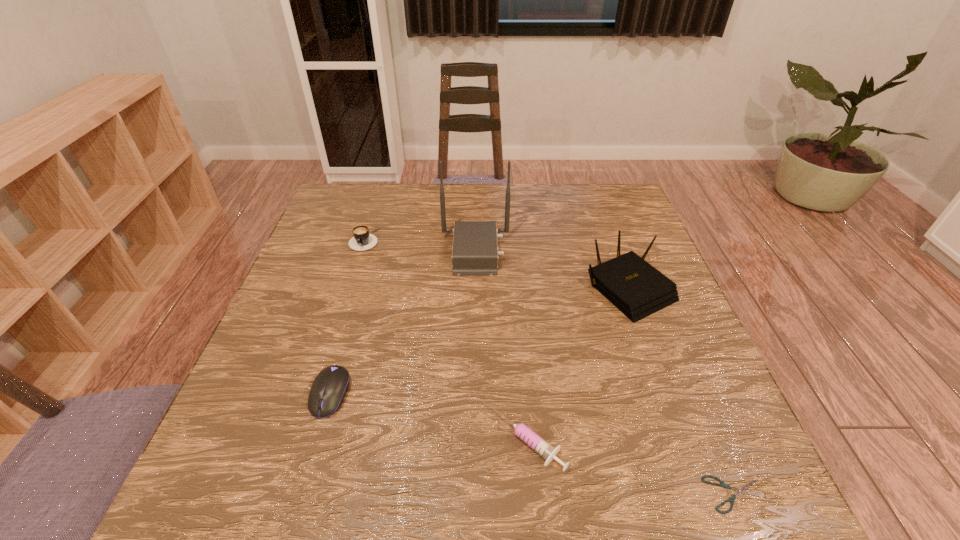
At what (x,y) coordinates should I click in order to perform the action: click on free space that satisfies the following two spatial constraints: 1. on the back of the tallest object to connect cables; 2. on the right side of the second tallest object. Please return your answer as a coordinate pair (x, y). This screenshot has width=960, height=540. Looking at the image, I should click on (475, 288).

Identify the location of free space in the image that satisfies the following two spatial constraints: 1. on the back side of the second tallest object; 2. on the left side of the syringe. (515, 288).